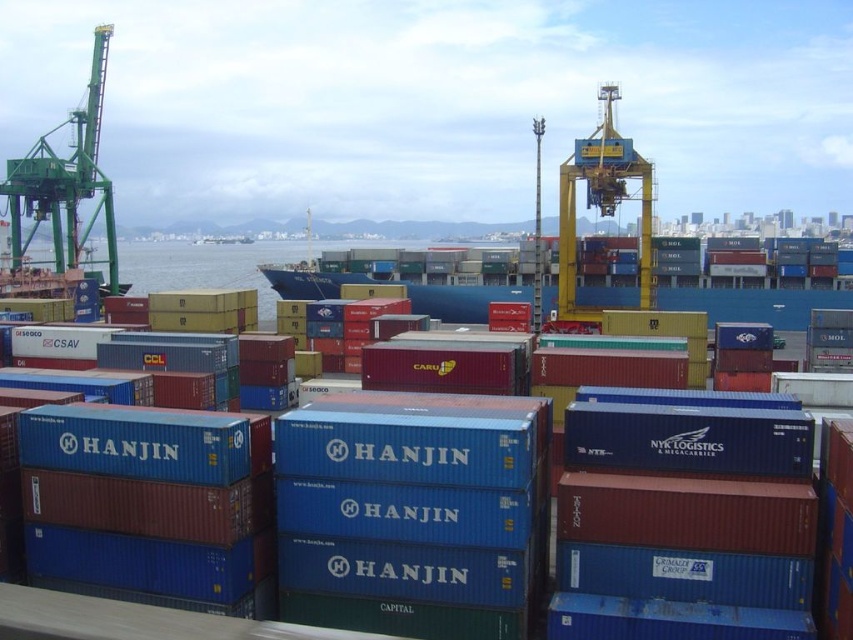
Question: Which point is closer to the camera?

Choices:
 (A) green painted metal crane at left
 (B) blue matte container at center

Answer: (B)

Question: Which of the following is the farthest from the observer?

Choices:
 (A) (44, 164)
 (B) (746, 593)

Answer: (A)

Question: Does blue matte container at center come behind green painted metal crane at left?

Choices:
 (A) yes
 (B) no

Answer: (B)

Question: Which point appears farthest from the camera in this image?

Choices:
 (A) (79, 221)
 (B) (451, 464)

Answer: (A)

Question: Can you confirm if blue matte container at center is thinner than green painted metal crane at left?

Choices:
 (A) no
 (B) yes

Answer: (A)

Question: Where is blue matte container at center located in relation to green painted metal crane at left in the image?

Choices:
 (A) above
 (B) below

Answer: (B)